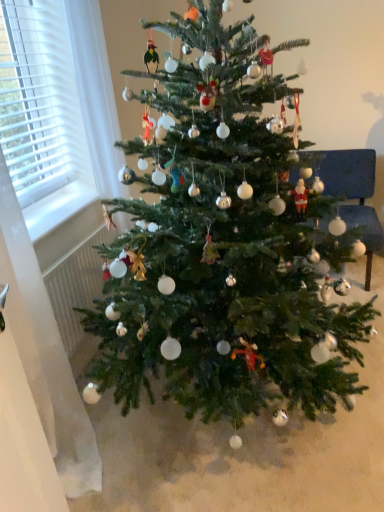
Question: Considering their positions, is green matte christmas tree at center located in front of or behind velvet blue armchair at right?

Choices:
 (A) front
 (B) behind

Answer: (A)

Question: Looking at the image, does green matte christmas tree at center seem bigger or smaller compared to velvet blue armchair at right?

Choices:
 (A) small
 (B) big

Answer: (B)

Question: From the image's perspective, relative to velvet blue armchair at right, is green matte christmas tree at center above or below?

Choices:
 (A) above
 (B) below

Answer: (B)

Question: Is velvet blue armchair at right in front of or behind green matte christmas tree at center in the image?

Choices:
 (A) behind
 (B) front

Answer: (A)

Question: From their relative heights in the image, would you say velvet blue armchair at right is taller or shorter than green matte christmas tree at center?

Choices:
 (A) short
 (B) tall

Answer: (A)

Question: Is velvet blue armchair at right situated inside green matte christmas tree at center or outside?

Choices:
 (A) inside
 (B) outside

Answer: (B)

Question: From a real-world perspective, is velvet blue armchair at right positioned above or below green matte christmas tree at center?

Choices:
 (A) above
 (B) below

Answer: (B)